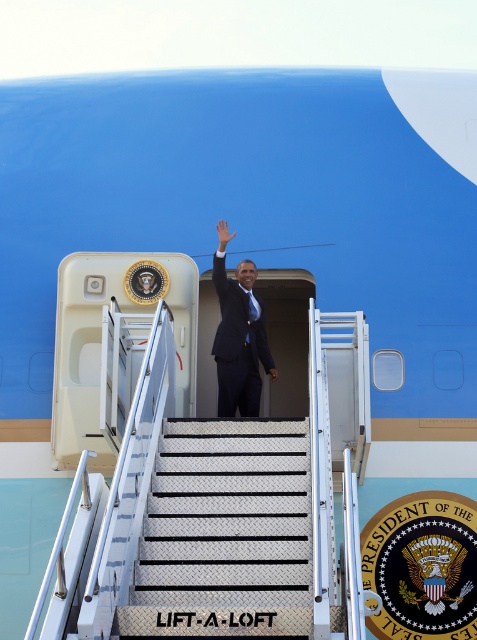
You are a photographer trying to capture a clear image of the dark blue suit at center and the diamond plate metal stairs at center. If you want to focus on the larger object, which one should you adjust your camera to focus on?

The diamond plate metal stairs at center is larger in size than the dark blue suit at center, so you should adjust your camera to focus on the diamond plate metal stairs at center.

You are a photographer positioned at the bottom of the aircraft stairs. You want to take a photo of the dark blue suit at center and the white matte hand at center. Which object should you focus on first to ensure it appears sharp in the photo?

The dark blue suit at center is further to the viewer than the white matte hand at center, so you should focus on the dark blue suit at center first to ensure it is sharp, as objects closer to the camera require focusing on them first to maintain sharpness in the photo.

You are a flight attendant on the aircraft and need to guide passengers down the stairs. The diamond plate metal stairs at center and the white matte hand at center are both visible. Which object is wider?

The diamond plate metal stairs at center is wider than the white matte hand at center because the stairs have a greater width according to the description.